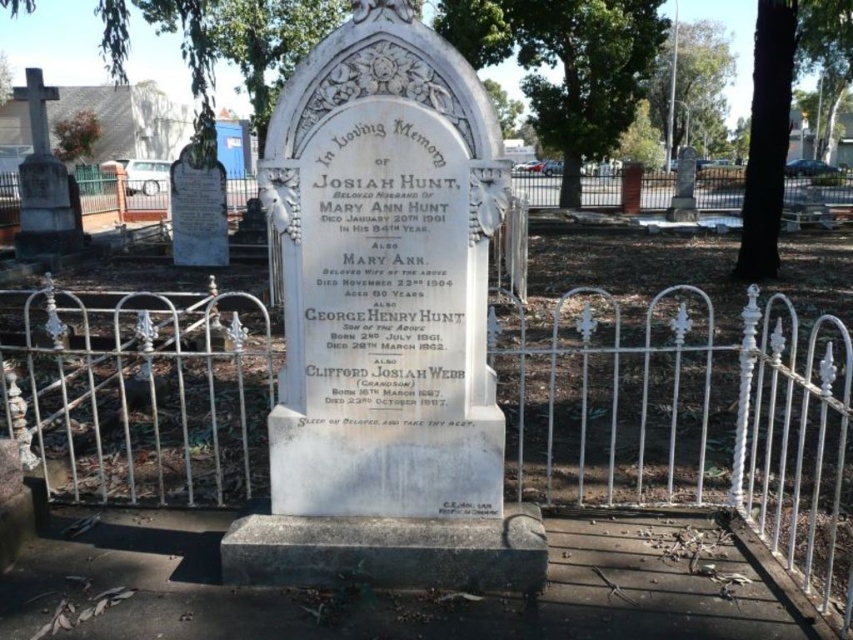
Question: Is green leafy tree at upper center smaller than dark green bark at upper right?

Choices:
 (A) yes
 (B) no

Answer: (A)

Question: Which object is closer to the camera taking this photo?

Choices:
 (A) green leafy tree at upper center
 (B) green leafy tree at upper right

Answer: (A)

Question: Is white marble gravestone at center further to the viewer compared to dark green bark at upper right?

Choices:
 (A) no
 (B) yes

Answer: (A)

Question: Which object is farther from the camera taking this photo?

Choices:
 (A) white wrought iron fence at upper center
 (B) white marble gravestone at center
 (C) green leafy tree at upper center
 (D) dark green bark at upper right

Answer: (C)

Question: Which object is the farthest from the green leafy tree at upper center?

Choices:
 (A) smooth white cross at left
 (B) white marble gravestone at center
 (C) white wrought iron fence at center

Answer: (B)

Question: Can you confirm if green leafy tree at upper center is bigger than white wrought iron fence at upper center?

Choices:
 (A) yes
 (B) no

Answer: (B)